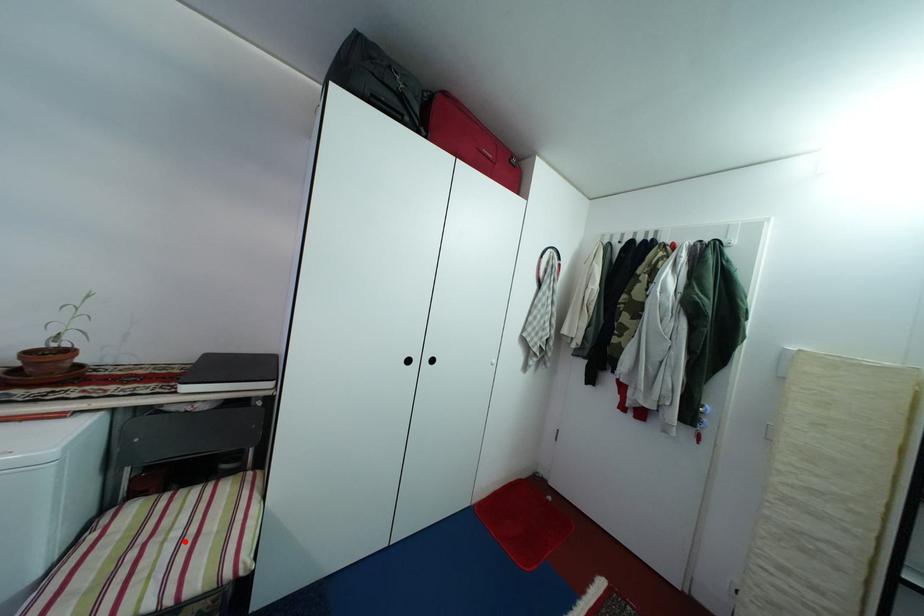
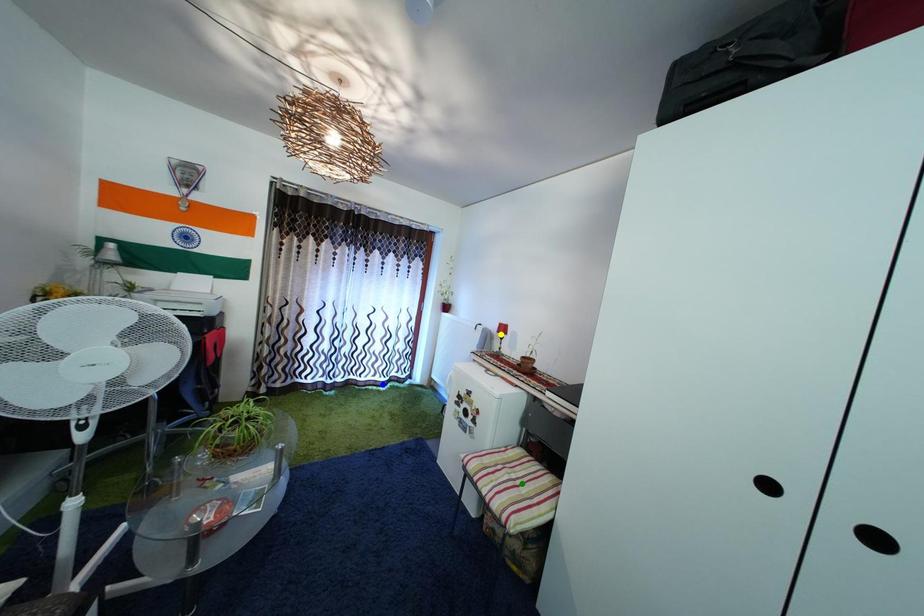
Question: I am providing you with two images of the same scene from different viewpoints. A red point is marked on the first image. You are given multiple points on the second image. Can you choose the point in image 2 that corresponds to the point in image 1?

Choices:
 (A) blue point
 (B) green point
 (C) yellow point

Answer: (B)